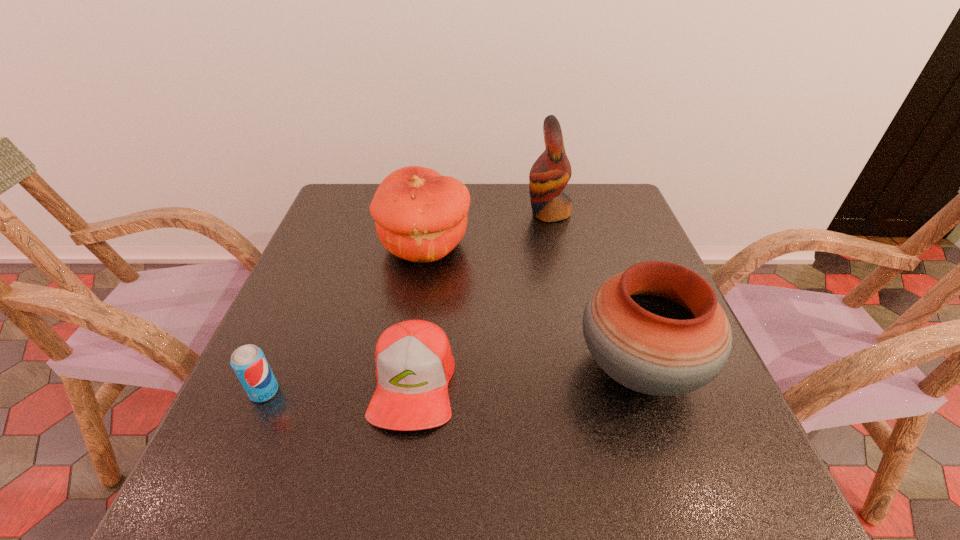
Where is `parrot`? This screenshot has width=960, height=540. parrot is located at coordinates tap(551, 172).

The height and width of the screenshot is (540, 960). I want to click on pumpkin, so click(x=420, y=216).

Where is `pottery`? pottery is located at coordinates (656, 328).

I want to click on soda can, so click(x=249, y=363).

Find the location of `baseball cap`. baseball cap is located at coordinates click(414, 363).

Identify the location of vacant space located 0.080m on the face of the tallest object. The width and height of the screenshot is (960, 540). (498, 213).

Where is `vacant space located on the face of the tallest object`? vacant space located on the face of the tallest object is located at coordinates (463, 213).

This screenshot has width=960, height=540. Find the location of `vacant space located 0.130m on the face of the tallest object`. vacant space located 0.130m on the face of the tallest object is located at coordinates (481, 213).

Where is `free space located on the front of the pumpkin`? free space located on the front of the pumpkin is located at coordinates (412, 333).

The width and height of the screenshot is (960, 540). In order to click on free point located 0.050m on the back of the pottery in this screenshot , I will do `click(618, 305)`.